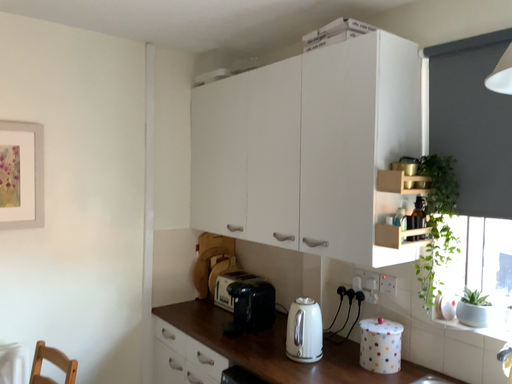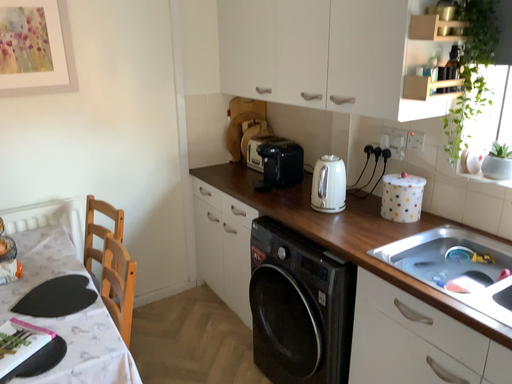
Question: How did the camera likely rotate when shooting the video?

Choices:
 (A) rotated downward
 (B) rotated upward

Answer: (A)